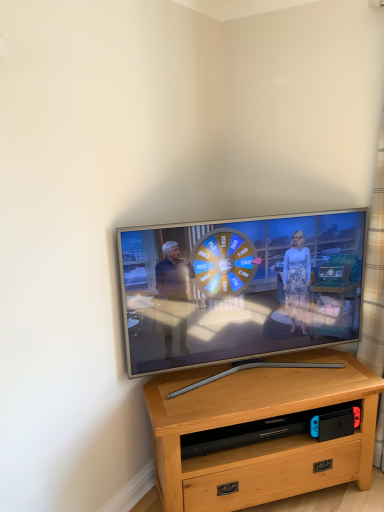
Question: From a real-world perspective, is silver metallic tv at center above or below light brown wood desk at center?

Choices:
 (A) above
 (B) below

Answer: (A)

Question: Is silver metallic tv at center bigger or smaller than light brown wood desk at center?

Choices:
 (A) small
 (B) big

Answer: (A)

Question: Which is farther from the plaid fabric curtain at right?

Choices:
 (A) light brown wood desk at center
 (B) silver metallic tv at center

Answer: (A)

Question: Estimate the real-world distances between objects in this image. Which object is closer to the light brown wood desk at center?

Choices:
 (A) plaid fabric curtain at right
 (B) silver metallic tv at center

Answer: (B)